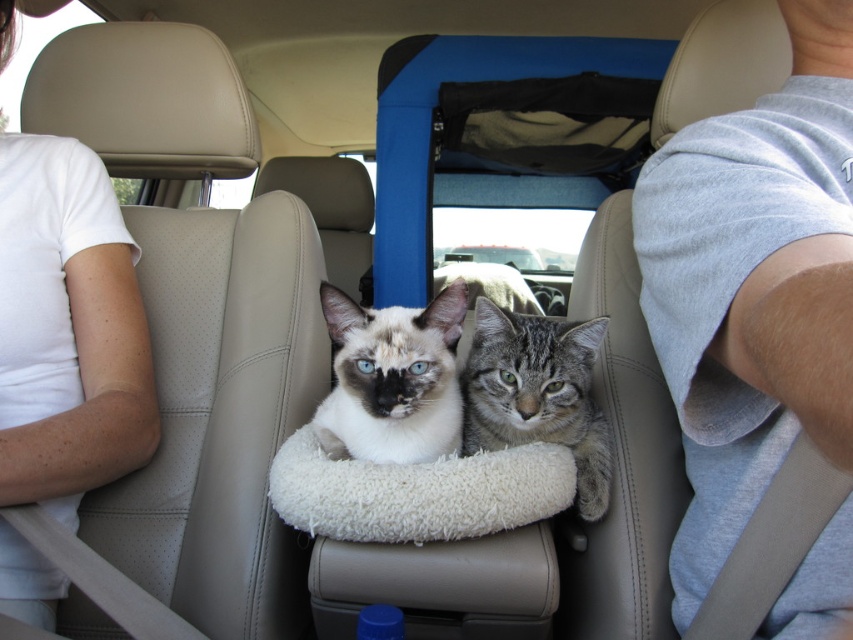
You are a delivery robot that needs to place a package at point (683, 609) in the car. The package is 1 meter long. Can you fit the package horizontally along the car seat without exceeding the car seat length? The car seat length from front to back is 1.2 meters.

The distance between point (683, 609) and the camera is 88.47 centimeters. Since the package is 1 meter long and the car seat is 1.2 meters long, there is enough space to fit the package horizontally as 1 meter is less than 1.2 meters.

You are sitting in the driver seat of the car and want to place a new cat bed at point (416, 492). Where exactly should you put it?

The white fluffy cat bed at center is located at point (416, 492), so you should place the new cat bed at the center where the white fluffy cat bed is currently positioned.